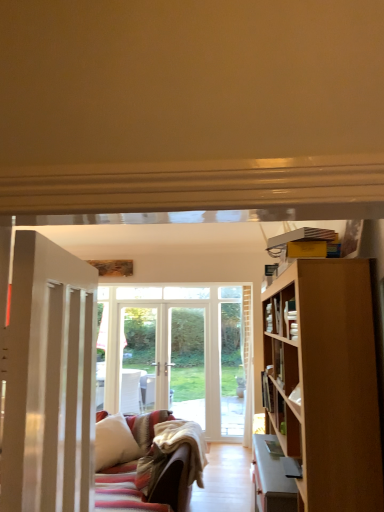
Question: From a real-world perspective, is wooden bookshelf at right below white painted wood door at left?

Choices:
 (A) no
 (B) yes

Answer: (A)

Question: Considering the relative sizes of wooden bookshelf at right and white painted wood door at left in the image provided, is wooden bookshelf at right smaller than white painted wood door at left?

Choices:
 (A) yes
 (B) no

Answer: (A)

Question: Does wooden bookshelf at right touch white painted wood door at left?

Choices:
 (A) no
 (B) yes

Answer: (A)

Question: Is wooden bookshelf at right oriented away from white painted wood door at left?

Choices:
 (A) yes
 (B) no

Answer: (B)

Question: From a real-world perspective, is wooden bookshelf at right located higher than white painted wood door at left?

Choices:
 (A) no
 (B) yes

Answer: (B)

Question: Considering their positions, is white painted wood door at left located in front of or behind wooden bookshelf at right?

Choices:
 (A) front
 (B) behind

Answer: (A)

Question: Is white painted wood door at left taller or shorter than wooden bookshelf at right?

Choices:
 (A) short
 (B) tall

Answer: (B)

Question: Considering the positions of white painted wood door at left and wooden bookshelf at right in the image, is white painted wood door at left bigger or smaller than wooden bookshelf at right?

Choices:
 (A) small
 (B) big

Answer: (B)

Question: From a real-world perspective, relative to wooden bookshelf at right, is white painted wood door at left vertically above or below?

Choices:
 (A) below
 (B) above

Answer: (A)

Question: Is hardcover book at right inside the boundaries of white painted wood door at left, or outside?

Choices:
 (A) outside
 (B) inside

Answer: (A)

Question: Relative to white painted wood door at left, is hardcover book at right in front or behind?

Choices:
 (A) behind
 (B) front

Answer: (A)

Question: From their relative heights in the image, would you say hardcover book at right is taller or shorter than white painted wood door at left?

Choices:
 (A) short
 (B) tall

Answer: (A)

Question: Considering the positions of hardcover book at right and white painted wood door at left in the image, is hardcover book at right wider or thinner than white painted wood door at left?

Choices:
 (A) thin
 (B) wide

Answer: (A)

Question: In terms of size, does wooden bookshelf at right appear bigger or smaller than hardcover book at right?

Choices:
 (A) small
 (B) big

Answer: (B)

Question: From the image's perspective, is wooden bookshelf at right located above or below hardcover book at right?

Choices:
 (A) below
 (B) above

Answer: (B)